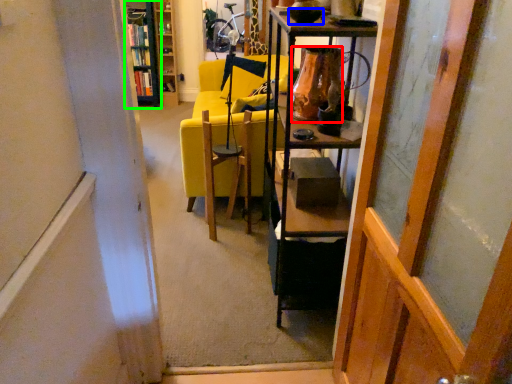
Question: Based on their relative distances, which object is farther from vase (highlighted by a red box)? Choose from bowl (highlighted by a blue box) and cabinetry (highlighted by a green box).

Choices:
 (A) bowl
 (B) cabinetry

Answer: (B)